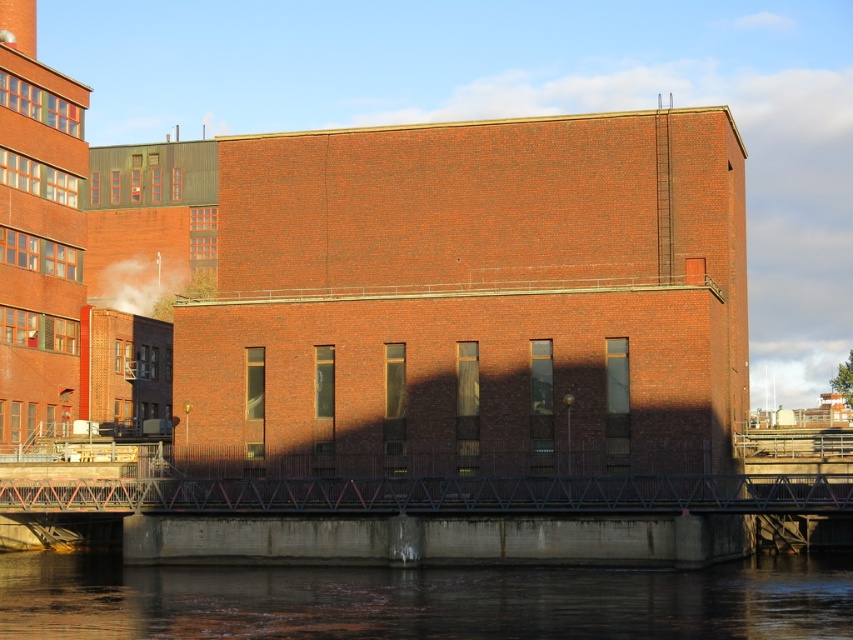
You are a photographer planning to capture the waterfront scene. You notice the red brick building at center and the white smoke at upper left. Which object would appear larger in your photo if you frame the shot to include both?

The red brick building at center would appear larger in the photo because it is much taller than the white smoke at upper left.

You are standing on the dock and looking at the scene. You see the red brick building at center and the dark concrete water at lower center. Which object is positioned to the right side of the other?

The red brick building at center is to the right of dark concrete water at lower center.

You are standing in front of the industrial brick building and want to take a photo that includes both the dark concrete water at lower center and the white smoke at upper left. Which object will appear larger in the photo?

The dark concrete water at lower center will appear larger in the photo because it is closer to the viewer than the white smoke at upper left.